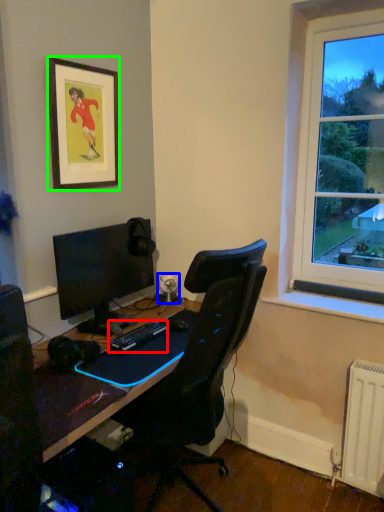
Question: Considering the real-world distances, which object is closest to computer keyboard (highlighted by a red box)? speaker (highlighted by a blue box) or picture frame (highlighted by a green box).

Choices:
 (A) speaker
 (B) picture frame

Answer: (A)